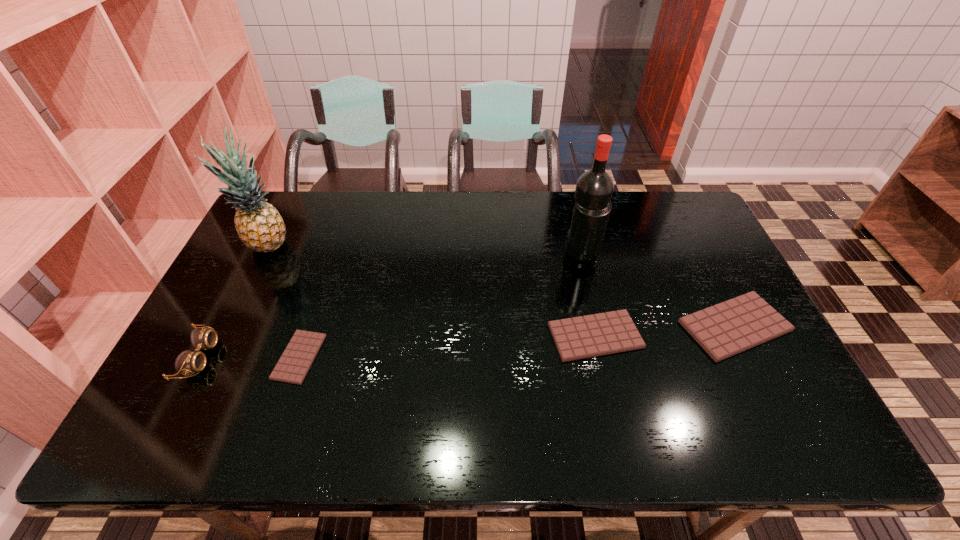
The height and width of the screenshot is (540, 960). I want to click on blank space located 0.120m on the left of the rightmost chocolate bar, so click(636, 326).

Where is `free space located on the right of the wine bottle`? This screenshot has height=540, width=960. free space located on the right of the wine bottle is located at coordinates (655, 253).

Locate an element on the screen. The height and width of the screenshot is (540, 960). free region located 0.280m on the front of the pineapple is located at coordinates (226, 339).

You are a GUI agent. You are given a task and a screenshot of the screen. Output one action in this format:
    pyautogui.click(x=<x>, y=<y>)
    Task: Click on the vacant space situated 0.060m through the lenses of the goggles
    The image size is (960, 540).
    Given the screenshot: What is the action you would take?
    pyautogui.click(x=236, y=357)

The width and height of the screenshot is (960, 540). What are the coordinates of `object located at the far edge` in the screenshot? It's located at (259, 225).

Locate an element on the screen. chocolate bar located at the near edge is located at coordinates (292, 367).

At what (x,y) coordinates should I click in order to perform the action: click on goggles positioned at the near edge. Please return your answer as a coordinate pair (x, y). Looking at the image, I should click on (188, 362).

You are a GUI agent. You are given a task and a screenshot of the screen. Output one action in this format:
    pyautogui.click(x=<x>, y=<y>)
    Task: Click on the pineapple present at the left edge
    This screenshot has height=540, width=960.
    Given the screenshot: What is the action you would take?
    pyautogui.click(x=259, y=225)

The image size is (960, 540). I want to click on goggles at the left edge, so click(188, 362).

Locate an element on the screen. object located at the right edge is located at coordinates (728, 328).